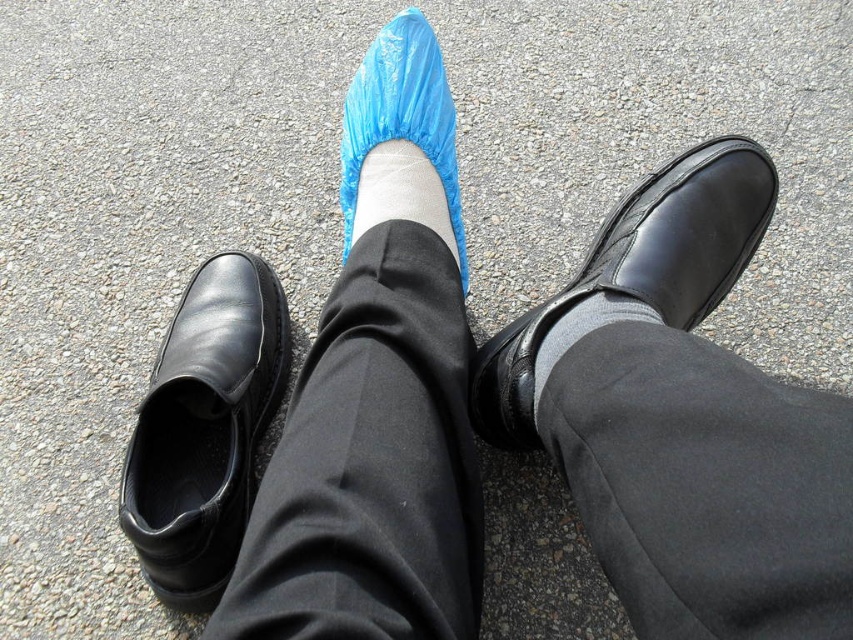
Question: Estimate the real-world distances between objects in this image. Which object is closer to the white matte sock at center?

Choices:
 (A) black leather shoe at upper right
 (B) blue plastic shoe cover at center

Answer: (B)

Question: Which point appears farthest from the camera in this image?

Choices:
 (A) (363, 150)
 (B) (155, 413)
 (C) (659, 289)

Answer: (A)

Question: Can you confirm if black leather shoe at left is positioned to the right of black leather shoe at upper right?

Choices:
 (A) no
 (B) yes

Answer: (A)

Question: Can you confirm if blue plastic shoe cover at center is bigger than white matte sock at center?

Choices:
 (A) yes
 (B) no

Answer: (A)

Question: Estimate the real-world distances between objects in this image. Which object is closer to the blue plastic shoe cover at center?

Choices:
 (A) black leather shoe at upper right
 (B) white matte sock at center

Answer: (B)

Question: From the image, what is the correct spatial relationship of blue plastic shoe cover at center in relation to white matte sock at center?

Choices:
 (A) above
 (B) below

Answer: (A)